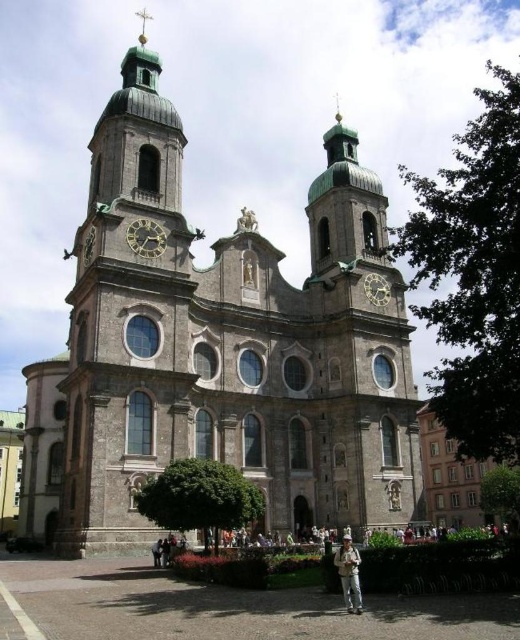
Who is higher up, gray stone church at center or polished brass clock at center?

Positioned higher is gray stone church at center.

Identify the location of gray stone church at center. (219, 349).

Between point (372, 422) and point (370, 300), which one is positioned behind?

Positioned behind is point (370, 300).

Where is `gray stone church at center`? The width and height of the screenshot is (520, 640). gray stone church at center is located at coordinates (219, 349).

Is point (254, 474) farther from viewer compared to point (356, 557)?

Yes, it is.

Can you confirm if gray stone church at center is positioned to the right of khaki fabric jacket at lower center?

In fact, gray stone church at center is to the left of khaki fabric jacket at lower center.

Does point (169, 456) come in front of point (345, 577)?

No, (169, 456) is behind (345, 577).

Locate an element on the screen. gray stone church at center is located at coordinates (219, 349).

Between gray stone church at center and gold metallic clock at center, which one is positioned lower?

gold metallic clock at center is lower down.

Does gray stone church at center have a greater width compared to gold metallic clock at center?

Indeed, gray stone church at center has a greater width compared to gold metallic clock at center.

Is point (226, 321) positioned behind point (138, 237)?

That is True.

Identify the location of gray stone church at center. (219, 349).